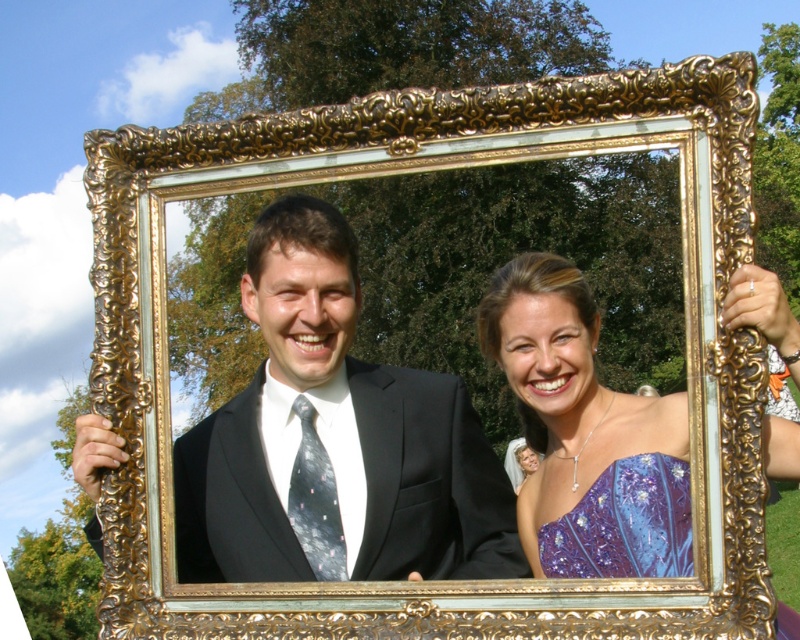
Question: Is the position of black satin suit at center less distant than that of shiny blue dress at center?

Choices:
 (A) yes
 (B) no

Answer: (B)

Question: Is black satin suit at center positioned at the back of sparkly blue dress at center?

Choices:
 (A) no
 (B) yes

Answer: (B)

Question: Which point is closer to the camera?

Choices:
 (A) (664, 417)
 (B) (660, 470)

Answer: (B)

Question: Which of the following is the farthest from the observer?

Choices:
 (A) shiny blue dress at center
 (B) sparkly blue dress at center

Answer: (B)

Question: Can you confirm if shiny blue dress at center is bigger than sparkly blue dress at center?

Choices:
 (A) yes
 (B) no

Answer: (A)

Question: Which object appears closest to the camera in this image?

Choices:
 (A) shiny blue dress at center
 (B) black satin suit at center
 (C) sparkly blue dress at center

Answer: (A)